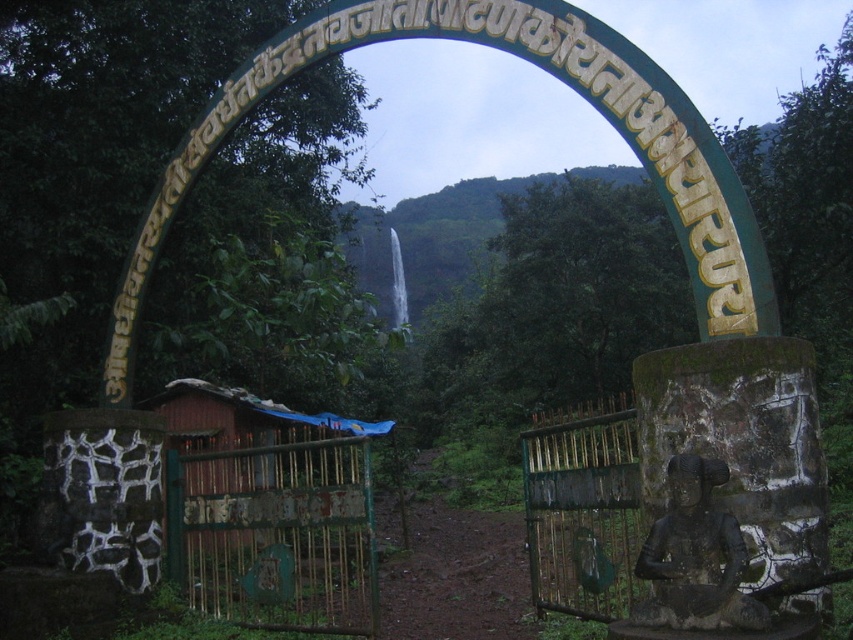
Looking at this image, you are standing in front of the green stone archway at center and want to enter the wooden hut at center. Which direction should you move towards relative to the archway?

The wooden hut at center is to the right of the green stone archway at center, so you should move towards the right side relative to the archway to enter the wooden hut at center.

You are standing at the center of the archway and want to place a new decorative item exactly where the black stone statue at lower right is currently positioned. According to the coordinates provided, what are the exact coordinates where you should place the new item?

The black stone statue at lower right is located at point (695, 557), so you should place the new item at those coordinates.